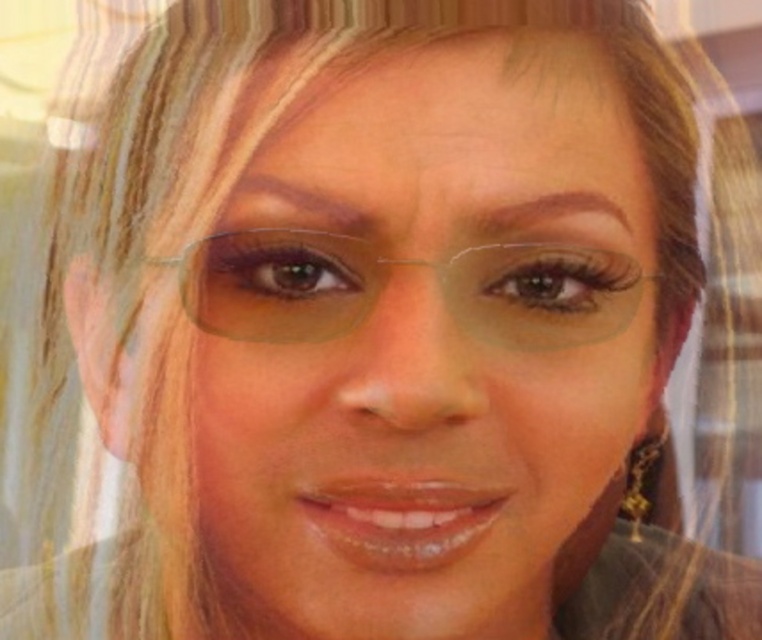
You are a stylist preparing for a photoshoot and need to adjust the accessories on the model. The model has clear plastic glasses at center and a gold metallic earring at lower right. Which accessory is positioned more to the left?

The clear plastic glasses at center are positioned to the left of the gold metallic earring at lower right, so they are more to the left.

You are a photographer adjusting your camera settings to capture the clear plastic glasses at center and the gold metallic earring at lower right. Which object should you focus on first if you want to ensure both are in sharp focus, considering their sizes?

The clear plastic glasses at center is not as tall as the gold metallic earring at lower right, so you should focus on the gold metallic earring at lower right first since it is larger and might require more precise focus.